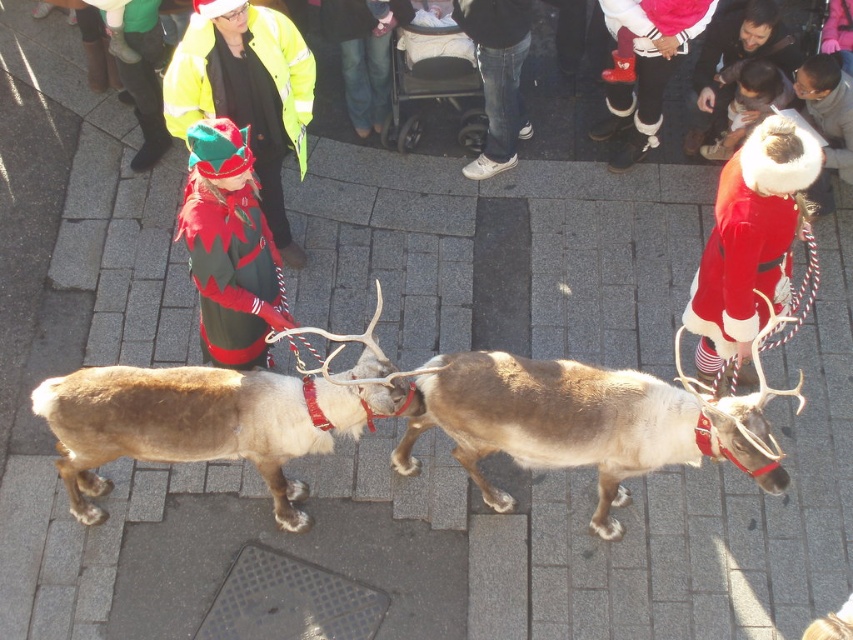
You are a photographer standing in the crowd observing the festive scene. You want to take a photo of both the velvet red coat at upper right and the velvet green coat at center. Which coat should you adjust your camera angle to focus on first to ensure both are in the frame?

The velvet red coat at upper right is in front of the velvet green coat at center, so you should focus on the velvet red coat at upper right first to ensure it doesn not block the view of the velvet green coat at center when framing both in the photo.

You are a photographer standing in the square and want to take a photo of both the velvet red coat at upper right and the velvet green coat at center. Can you fit both in the frame if your camera has a 10 feet wide field of view?

The velvet red coat at upper right is 8.45 feet away from the velvet green coat at center. Since the distance between them is less than the camera field of view of 10 feet, both can be captured in the frame.

You are a photographer trying to capture a photo of both the brown fuzzy reindeer at center and the velvet red coat at upper right in the same frame. Based on their positions, which one should you focus on first to ensure both are in the shot?

The brown fuzzy reindeer at center is positioned on the left side of velvet red coat at upper right, so you should focus on the velvet red coat at upper right first to ensure both are in the shot.